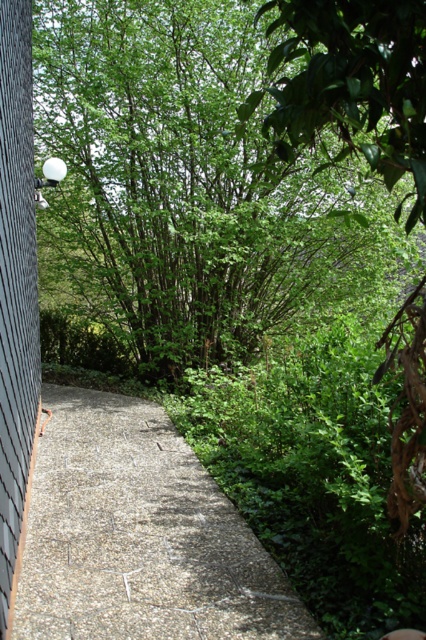
Question: Does green leafy tree at upper center have a smaller size compared to gravelly stone path at center?

Choices:
 (A) yes
 (B) no

Answer: (B)

Question: Estimate the real-world distances between objects in this image. Which object is closer to the gravelly stone path at center?

Choices:
 (A) green leafy tree at upper center
 (B) gray textured siding at left

Answer: (B)

Question: Which point is farther to the camera?

Choices:
 (A) (362, 90)
 (B) (2, 472)
 (C) (141, 426)

Answer: (C)

Question: Is green leafy tree at upper center behind gravelly stone path at center?

Choices:
 (A) no
 (B) yes

Answer: (A)

Question: Which object appears farthest from the camera in this image?

Choices:
 (A) gravelly stone path at center
 (B) gray textured siding at left
 (C) green leafy tree at upper center

Answer: (A)

Question: In this image, where is green leafy tree at upper center located relative to gray textured siding at left?

Choices:
 (A) right
 (B) left

Answer: (A)